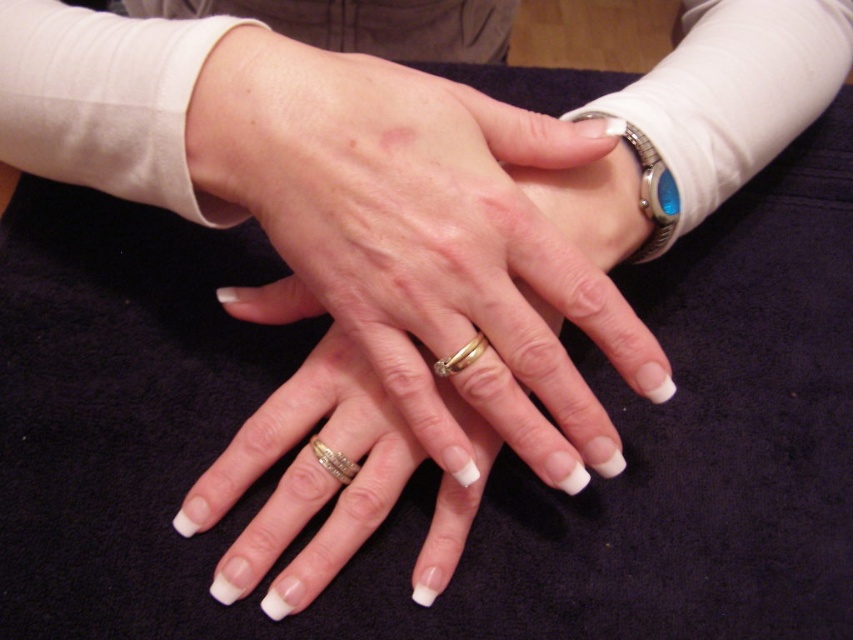
Question: In this image, where is metallic silver watch at upper right located relative to gold shiny band at center?

Choices:
 (A) right
 (B) left

Answer: (A)

Question: Can you confirm if metallic silver watch at upper right is positioned to the left of gold shiny band at center?

Choices:
 (A) no
 (B) yes

Answer: (A)

Question: Based on their relative distances, which object is nearer to the gold textured band at center?

Choices:
 (A) metallic silver watch at upper right
 (B) gold shiny band at center

Answer: (B)

Question: Estimate the real-world distances between objects in this image. Which object is farther from the metallic silver watch at upper right?

Choices:
 (A) gold shiny band at center
 (B) gold textured band at center

Answer: (B)

Question: Is gold textured band at center positioned in front of gold shiny band at center?

Choices:
 (A) no
 (B) yes

Answer: (A)

Question: Which point is closer to the camera?

Choices:
 (A) gold textured band at center
 (B) metallic silver watch at upper right
 (C) gold shiny band at center

Answer: (C)